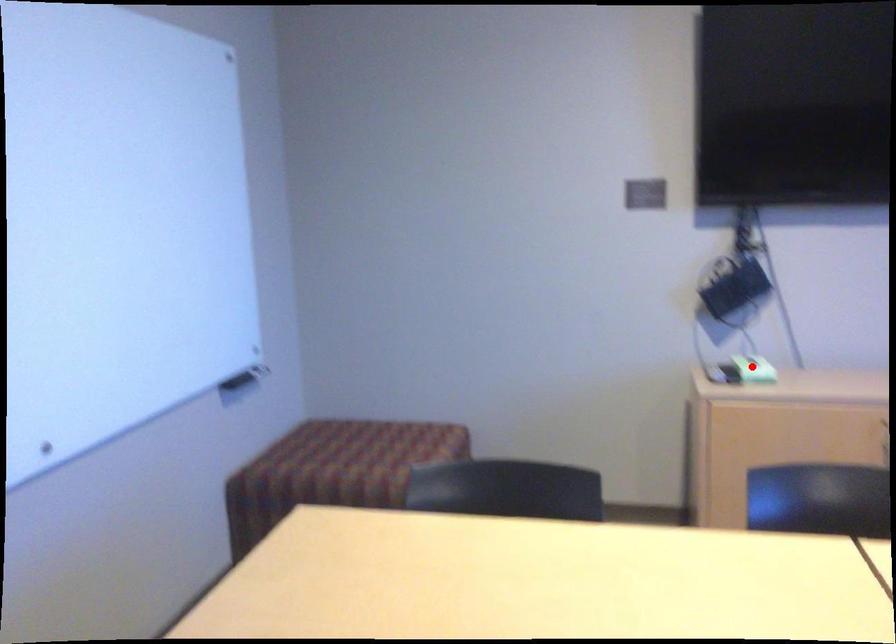
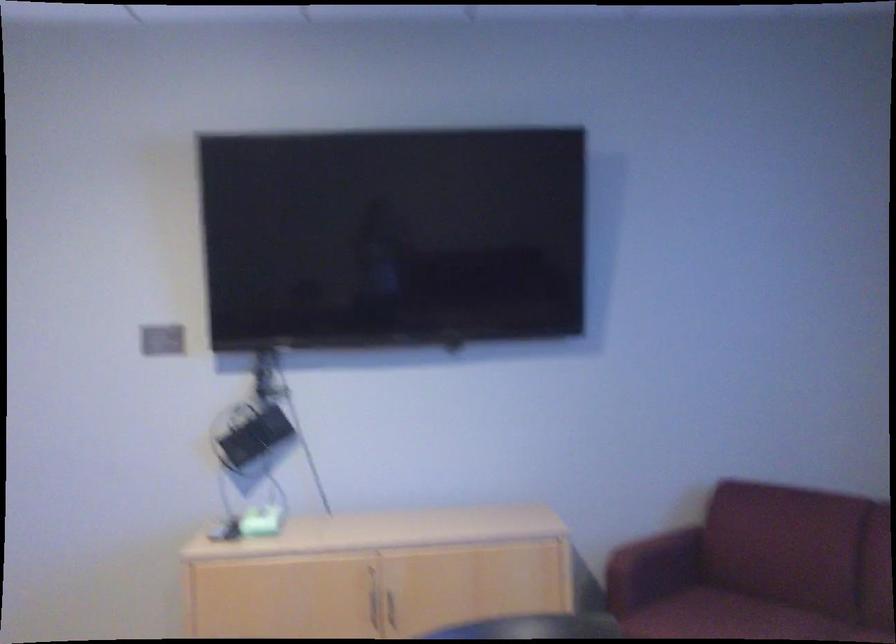
In the second image, find the point that corresponds to the highlighted location in the first image.

(257, 522)